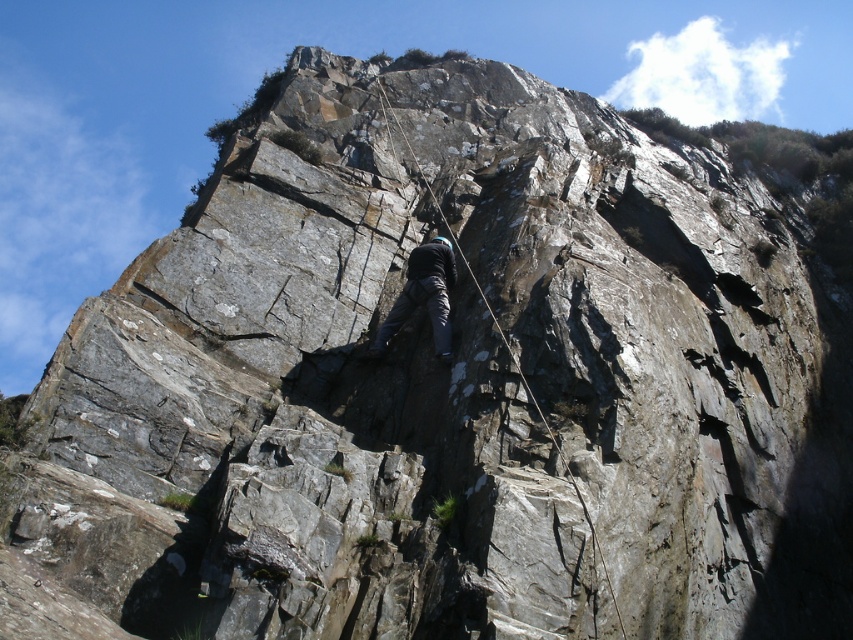
Question: Is dark blue fabric at center further to the viewer compared to rope at center?

Choices:
 (A) yes
 (B) no

Answer: (A)

Question: Which point is farther from the camera taking this photo?

Choices:
 (A) (527, 388)
 (B) (440, 282)

Answer: (B)

Question: Does dark blue fabric at center have a smaller size compared to rope at center?

Choices:
 (A) yes
 (B) no

Answer: (A)

Question: Among these objects, which one is farthest from the camera?

Choices:
 (A) rope at center
 (B) dark blue fabric at center

Answer: (B)

Question: Is dark blue fabric at center behind rope at center?

Choices:
 (A) yes
 (B) no

Answer: (A)